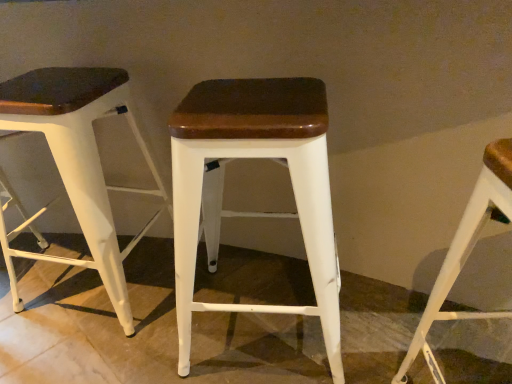
Question: Based on their sizes in the image, would you say white matte stool at right, acting as the 1th stool starting from the right, is bigger or smaller than white matte wood stool at center, the 3th stool viewed from the right?

Choices:
 (A) big
 (B) small

Answer: (B)

Question: In terms of width, does white matte stool at right, acting as the 1th stool starting from the right, look wider or thinner when compared to white matte wood stool at center, which is the first stool from left to right?

Choices:
 (A) wide
 (B) thin

Answer: (B)

Question: Which of these objects is positioned closest to the white matte wood stool at center, arranged as the second stool when viewed from the right?

Choices:
 (A) white matte stool at right, which ranks as the 3th stool in left-to-right order
 (B) white matte wood stool at center, the 3th stool viewed from the right

Answer: (A)

Question: Considering the real-world distances, which object is farthest from the white matte wood stool at center, the 3th stool viewed from the right?

Choices:
 (A) white matte stool at right, acting as the 1th stool starting from the right
 (B) white matte wood stool at center, which appears as the 2th stool when viewed from the left

Answer: (A)